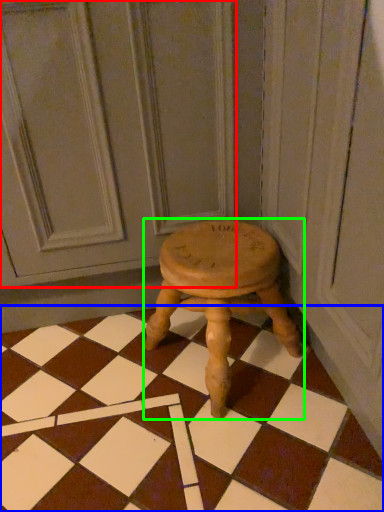
Question: Based on their relative distances, which object is nearer to screen door (highlighted by a red box)? Choose from square (highlighted by a blue box) and stool (highlighted by a green box).

Choices:
 (A) square
 (B) stool

Answer: (B)